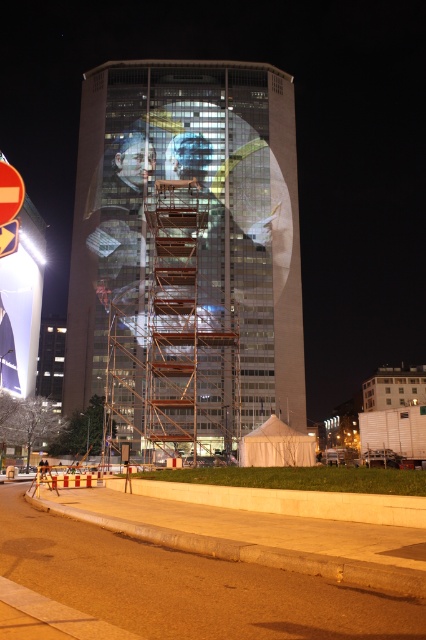
Who is lower down, matte glass tower at center or rustic metal scaffolding at center?

rustic metal scaffolding at center

Is matte glass tower at center below rustic metal scaffolding at center?

No, matte glass tower at center is not below rustic metal scaffolding at center.

Where is `matte glass tower at center`? This screenshot has width=426, height=640. matte glass tower at center is located at coordinates (186, 253).

Identify the location of matte glass tower at center. (186, 253).

Does matte glass tower at center have a greater width compared to metal scaffolding at center?

Yes, matte glass tower at center is wider than metal scaffolding at center.

Looking at this image, is matte glass tower at center to the left of metal scaffolding at center from the viewer's perspective?

Indeed, matte glass tower at center is positioned on the left side of metal scaffolding at center.

Is point (261, 131) farther from viewer compared to point (124, 541)?

Yes, point (261, 131) is behind point (124, 541).

I want to click on matte glass tower at center, so click(186, 253).

Which is in front, point (131, 557) or point (183, 204)?

Point (131, 557)

Does metal scaffolding at center have a greater height compared to rustic metal scaffolding at center?

No, metal scaffolding at center is not taller than rustic metal scaffolding at center.

Image resolution: width=426 pixels, height=640 pixels. In order to click on metal scaffolding at center in this screenshot , I will do `click(186, 586)`.